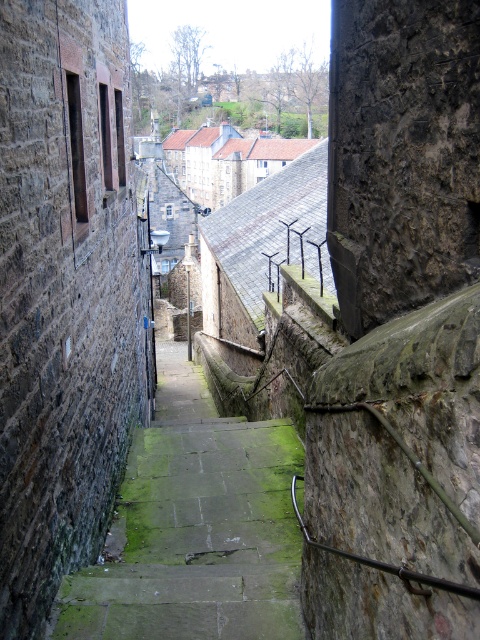
Does green mossy stone steps at center have a smaller size compared to clear glass window at upper center?

No.

Between green mossy stone steps at center and clear glass window at upper center, which one has more height?

With more height is green mossy stone steps at center.

This screenshot has width=480, height=640. What are the coordinates of `green mossy stone steps at center` in the screenshot? It's located at (194, 528).

The image size is (480, 640). I want to click on green mossy stone steps at center, so click(x=194, y=528).

Is point (239, 620) farther from viewer compared to point (122, 147)?

No, it is not.

The image size is (480, 640). What are the coordinates of `green mossy stone steps at center` in the screenshot? It's located at (194, 528).

At what (x,y) coordinates should I click in order to perform the action: click on green mossy stone steps at center. Please return your answer as a coordinate pair (x, y). Looking at the image, I should click on (194, 528).

Who is more distant from viewer, (117, 116) or (172, 212)?

Positioned behind is point (172, 212).

Who is positioned more to the left, brown wooden window at upper left or clear glass window at upper center?

clear glass window at upper center

Where is `brown wooden window at upper left`? The image size is (480, 640). brown wooden window at upper left is located at coordinates (110, 132).

Find the location of a particular element. brown wooden window at upper left is located at coordinates (110, 132).